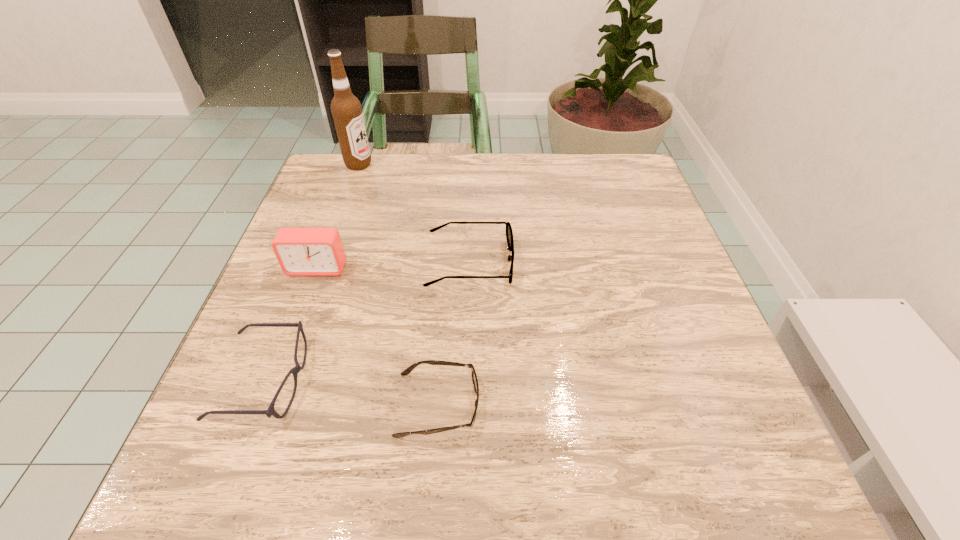
Find the location of a particular element. The width and height of the screenshot is (960, 540). free space located on the front-facing side of the shortest object is located at coordinates (632, 404).

The image size is (960, 540). Find the location of `object situated at the far edge`. object situated at the far edge is located at coordinates (346, 109).

Where is `object present at the near edge`? The width and height of the screenshot is (960, 540). object present at the near edge is located at coordinates (407, 371).

Identify the location of alcohol located in the left edge section of the desktop. Image resolution: width=960 pixels, height=540 pixels. (346, 109).

Locate an element on the screen. The height and width of the screenshot is (540, 960). alarm clock present at the left edge is located at coordinates (300, 251).

The width and height of the screenshot is (960, 540). In order to click on spectacles that is positioned at the left edge in this screenshot , I will do [270, 411].

The image size is (960, 540). Find the location of `object at the far left corner`. object at the far left corner is located at coordinates [x=346, y=109].

In order to click on free spot at the far edge of the desktop in this screenshot , I will do `click(491, 161)`.

The height and width of the screenshot is (540, 960). In order to click on vacant region at the near edge in this screenshot , I will do `click(484, 457)`.

Where is `vacant region at the left edge of the desktop`? This screenshot has width=960, height=540. vacant region at the left edge of the desktop is located at coordinates (320, 391).